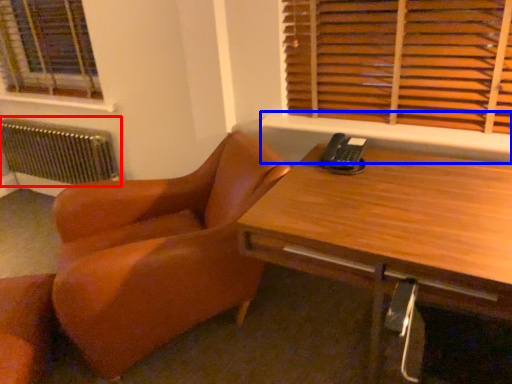
Question: Among these objects, which one is nearest to the camera, radiator (highlighted by a red box) or window sill (highlighted by a blue box)?

Choices:
 (A) radiator
 (B) window sill

Answer: (B)